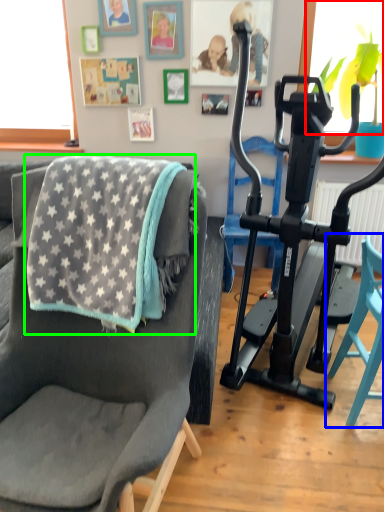
Question: Considering the real-world distances, which object is farthest from window screen (highlighted by a red box)? chair (highlighted by a blue box) or blanket (highlighted by a green box)?

Choices:
 (A) chair
 (B) blanket

Answer: (B)